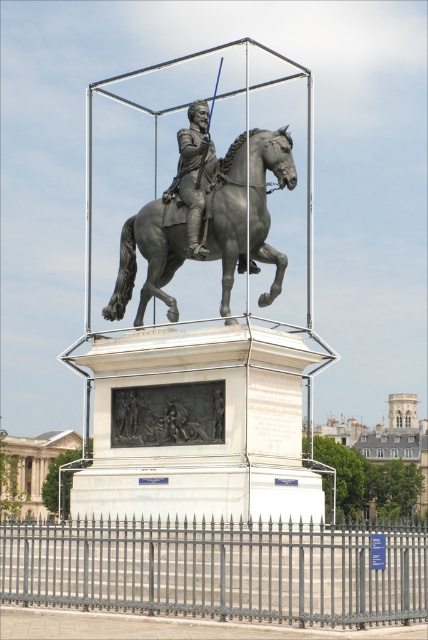
Which is above, transparent glass box at center or dark gray bas-relief at center?

transparent glass box at center

Find the location of a particular element. transparent glass box at center is located at coordinates (205, 342).

Is polished bronze horse at center to the right of polished bronze rider at center from the viewer's perspective?

Yes, polished bronze horse at center is to the right of polished bronze rider at center.

The width and height of the screenshot is (428, 640). Describe the element at coordinates (149, 257) in the screenshot. I see `polished bronze horse at center` at that location.

Image resolution: width=428 pixels, height=640 pixels. I want to click on polished bronze horse at center, so click(x=149, y=257).

Is point (166, 208) farther from camera compared to point (281, 275)?

Yes, it is.

What do you see at coordinates (205, 342) in the screenshot?
I see `transparent glass box at center` at bounding box center [205, 342].

The width and height of the screenshot is (428, 640). What are the coordinates of `transparent glass box at center` in the screenshot? It's located at (205, 342).